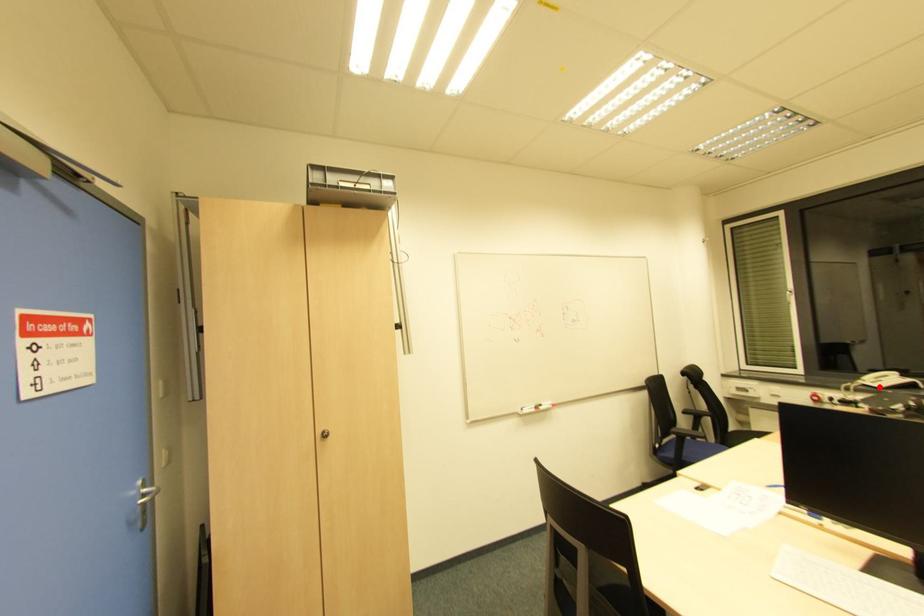
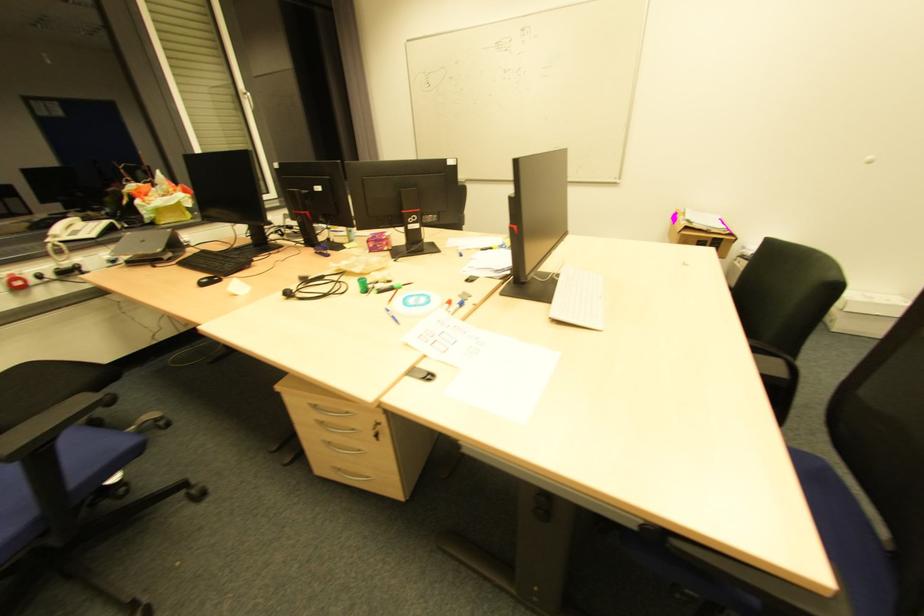
Locate, in the second image, the point that corresponds to the highlighted location in the first image.

(91, 237)